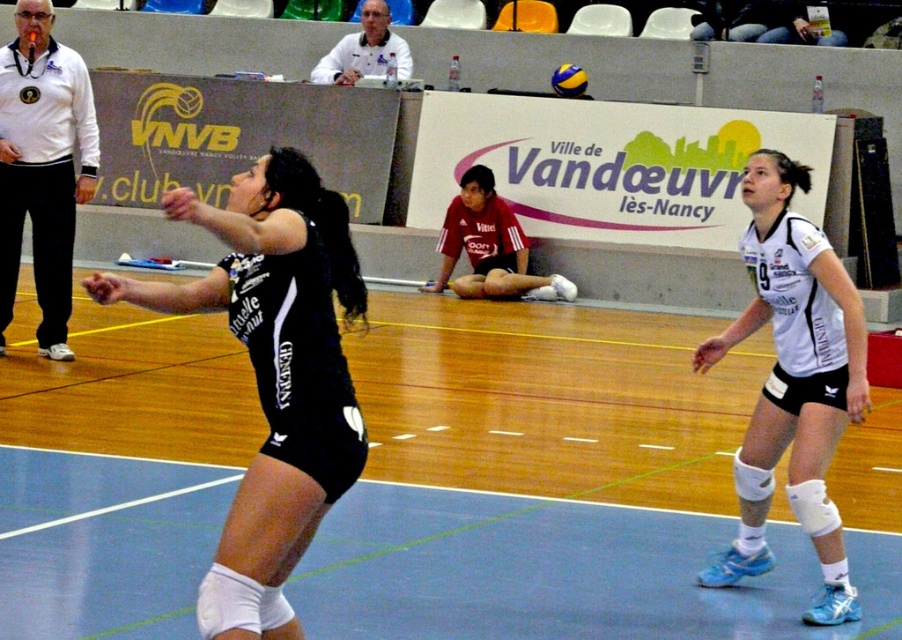
Can you confirm if blue rubber volleyball court at center is thinner than white matte jacket at left?

No, blue rubber volleyball court at center is not thinner than white matte jacket at left.

Which is behind, point (88, 388) or point (58, 344)?

The point (58, 344) is behind.

At what (x,y) coordinates should I click in order to perform the action: click on blue rubber volleyball court at center. Please return your answer as a coordinate pair (x, y). Image resolution: width=902 pixels, height=640 pixels. Looking at the image, I should click on (557, 456).

Is the position of white matte knee pads at right more distant than that of yellow matte volleyball at center?

No, it is in front of yellow matte volleyball at center.

From the picture: Who is taller, white matte knee pads at right or yellow matte volleyball at center?

Standing taller between the two is white matte knee pads at right.

Does point (825, 342) come farther from viewer compared to point (577, 90)?

No, it is in front of (577, 90).

Locate an element on the screen. The image size is (902, 640). white matte knee pads at right is located at coordinates (793, 381).

Is blue rubber volleyball court at center smaller than white matte knee pads at right?

Actually, blue rubber volleyball court at center might be larger than white matte knee pads at right.

Consider the image. Can you confirm if blue rubber volleyball court at center is shorter than white matte knee pads at right?

Correct, blue rubber volleyball court at center is not as tall as white matte knee pads at right.

The height and width of the screenshot is (640, 902). What do you see at coordinates (557, 456) in the screenshot?
I see `blue rubber volleyball court at center` at bounding box center [557, 456].

This screenshot has width=902, height=640. I want to click on blue rubber volleyball court at center, so pos(557,456).